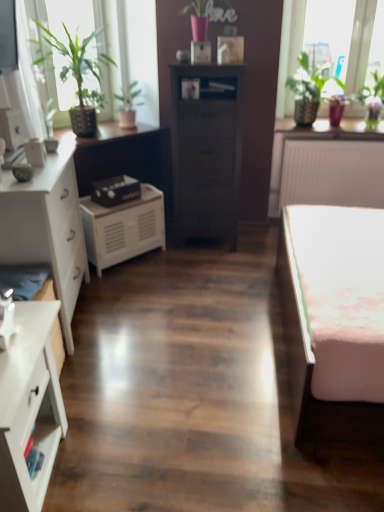
The height and width of the screenshot is (512, 384). What are the coordinates of `free spot in front of dark wood cabinet at center, the third chest of drawers from the left` in the screenshot? It's located at (213, 260).